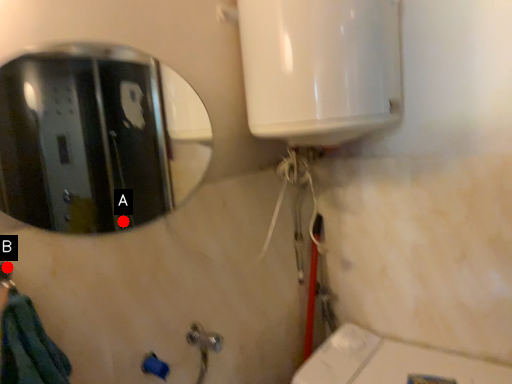
Question: Two points are circled on the image, labeled by A and B beside each circle. Which point is farther from the camera taking this photo?

Choices:
 (A) A is further
 (B) B is further

Answer: (A)